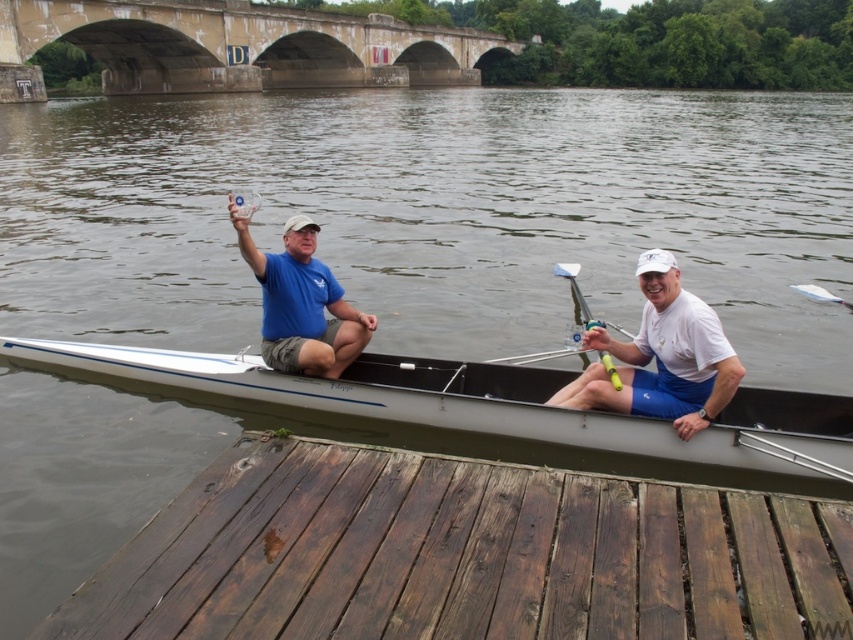
Is white glossy boat at center positioned at the back of yellow plastic paddle at center?

No.

Who is more forward, (430, 422) or (575, 280)?

Point (430, 422)

Image resolution: width=853 pixels, height=640 pixels. I want to click on white glossy boat at center, so click(490, 406).

Is weathered wood dock at lower left thinner than blue cotton shirt at center?

No, weathered wood dock at lower left is not thinner than blue cotton shirt at center.

In the scene shown: Is weathered wood dock at lower left shorter than blue cotton shirt at center?

Correct, weathered wood dock at lower left is not as tall as blue cotton shirt at center.

Locate an element on the screen. The height and width of the screenshot is (640, 853). weathered wood dock at lower left is located at coordinates (463, 554).

Is point (730, 419) in front of point (804, 289)?

Yes, it is in front of point (804, 289).

Between point (421, 400) and point (825, 291), which one is positioned behind?

Positioned behind is point (825, 291).

Is point (838, 416) behind point (851, 305)?

No, (838, 416) is in front of (851, 305).

This screenshot has height=640, width=853. Find the location of `white glossy boat at center`. white glossy boat at center is located at coordinates (490, 406).